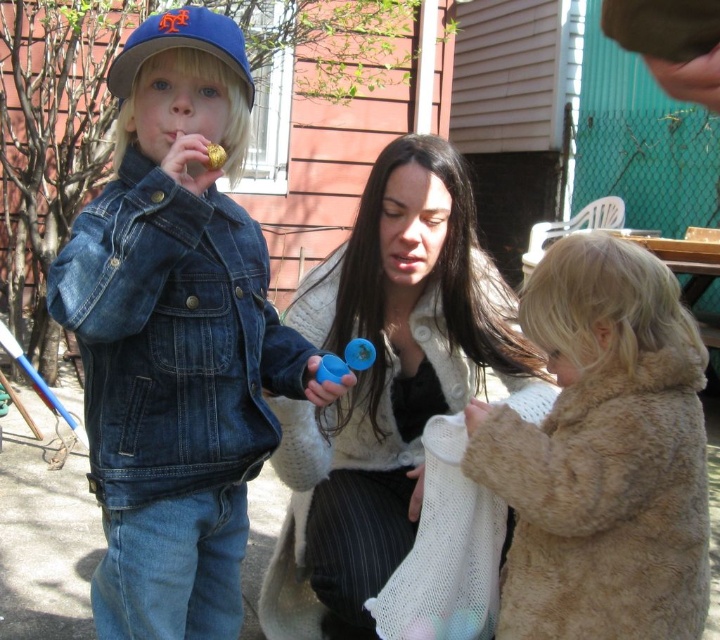
Can you confirm if blue matte baseball cap at upper left is positioned above gold shiny candy at center?

Indeed, blue matte baseball cap at upper left is positioned over gold shiny candy at center.

Who is more forward, (207, 29) or (211, 170)?

Point (211, 170) is in front.

Find the location of a particular element. This screenshot has width=720, height=640. blue matte baseball cap at upper left is located at coordinates (180, 45).

Is point (378, 188) positioned after point (359, 358)?

Yes, it is behind point (359, 358).

Between point (373, 404) and point (359, 344), which one is positioned behind?

Point (373, 404)

Where is `white fuzzy coat at center`? The image size is (720, 640). white fuzzy coat at center is located at coordinates 384,385.

Is blue matte baseball cap at upper left thinner than blue plastic toy at center?

Incorrect, blue matte baseball cap at upper left's width is not less than blue plastic toy at center's.

Between point (234, 67) and point (366, 353), which one is positioned in front?

Point (234, 67) is more forward.

Identify the location of blue matte baseball cap at upper left. (180, 45).